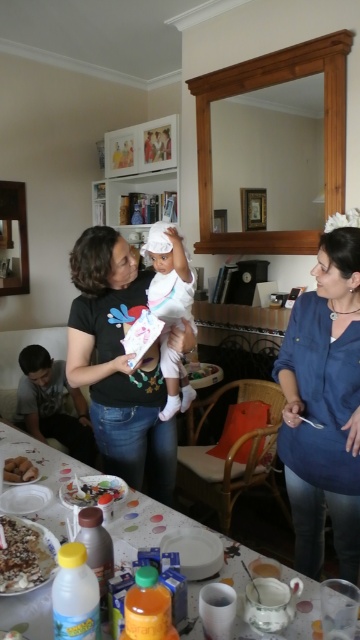
Can you confirm if black matte t-shirt at center is shorter than brown crumbly cake at lower left?

No, black matte t-shirt at center is not shorter than brown crumbly cake at lower left.

At what (x,y) coordinates should I click in order to perform the action: click on black matte t-shirt at center. Please return your answer as a coordinate pair (x, y). This screenshot has width=360, height=640. Looking at the image, I should click on (119, 364).

Locate an element on the screen. The height and width of the screenshot is (640, 360). black matte t-shirt at center is located at coordinates (119, 364).

Between blue fabric shirt at center and matte black shirt at center, which one has more height?

Standing taller between the two is blue fabric shirt at center.

Can you confirm if blue fabric shirt at center is positioned below matte black shirt at center?

Incorrect, blue fabric shirt at center is not positioned below matte black shirt at center.

Is point (347, 362) in front of point (16, 392)?

That is True.

Identify the location of blue fabric shirt at center. This screenshot has height=640, width=360. (324, 406).

Which of these two, blue fabric shirt at center or white glossy table at center, stands shorter?

Standing shorter between the two is white glossy table at center.

Does blue fabric shirt at center lie in front of white glossy table at center?

That is False.

Is point (316, 324) positioned after point (10, 432)?

No.

Identify the location of blue fabric shirt at center. The height and width of the screenshot is (640, 360). (324, 406).